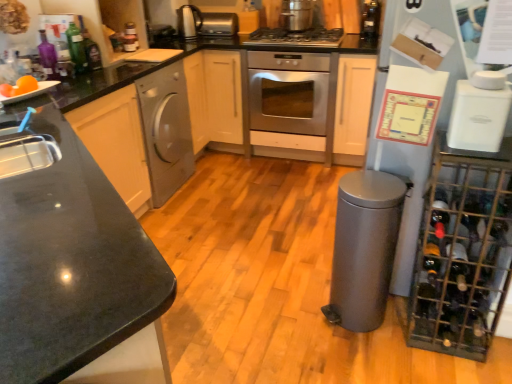
Question: Is orange matte at left to the left of translucent glass bottle at upper right, the first bottle in the right-to-left sequence, from the viewer's perspective?

Choices:
 (A) no
 (B) yes

Answer: (B)

Question: From the image's perspective, is orange matte at left above translucent glass bottle at upper right, placed as the 4th bottle when sorted from bottom to top?

Choices:
 (A) no
 (B) yes

Answer: (A)

Question: Considering the relative sizes of orange matte at left and translucent glass bottle at upper right, which is the fourth bottle in front-to-back order, in the image provided, is orange matte at left thinner than translucent glass bottle at upper right, which is the fourth bottle in front-to-back order,?

Choices:
 (A) yes
 (B) no

Answer: (B)

Question: Would you say translucent glass bottle at upper right, the first bottle in the right-to-left sequence, is part of orange matte at left's contents?

Choices:
 (A) no
 (B) yes

Answer: (A)

Question: Is orange matte at left positioned with its back to translucent glass bottle at upper right, which is the fourth bottle in front-to-back order?

Choices:
 (A) yes
 (B) no

Answer: (B)

Question: Is point (268, 39) positioned closer to the camera than point (501, 145)?

Choices:
 (A) farther
 (B) closer

Answer: (A)

Question: Based on their sizes in the image, would you say stainless steel gas stove at center is bigger or smaller than metallic wire wine rack at right?

Choices:
 (A) big
 (B) small

Answer: (B)

Question: Is stainless steel gas stove at center to the left or to the right of metallic wire wine rack at right in the image?

Choices:
 (A) right
 (B) left

Answer: (B)

Question: From their relative heights in the image, would you say stainless steel gas stove at center is taller or shorter than metallic wire wine rack at right?

Choices:
 (A) tall
 (B) short

Answer: (B)

Question: Is purple glass bottle at upper left, the first bottle in the front-to-back sequence, taller or shorter than orange matte at left?

Choices:
 (A) short
 (B) tall

Answer: (B)

Question: Considering their positions, is purple glass bottle at upper left, the fourth bottle from the top, located in front of or behind orange matte at left?

Choices:
 (A) front
 (B) behind

Answer: (B)

Question: Does point (39, 52) appear closer or farther from the camera than point (31, 82)?

Choices:
 (A) farther
 (B) closer

Answer: (A)

Question: In the image, is purple glass bottle at upper left, the fourth bottle from the top, on the left side or the right side of orange matte at left?

Choices:
 (A) right
 (B) left

Answer: (B)

Question: Which is correct: satin silver toaster at upper center, marked as the 3th appliance in a bottom-to-top arrangement, is inside stainless steel pot at upper center, the second kitchen appliance in the right-to-left sequence, or outside of it?

Choices:
 (A) inside
 (B) outside

Answer: (B)

Question: Considering the positions of point (204, 29) and point (303, 1), is point (204, 29) closer or farther from the camera than point (303, 1)?

Choices:
 (A) farther
 (B) closer

Answer: (A)